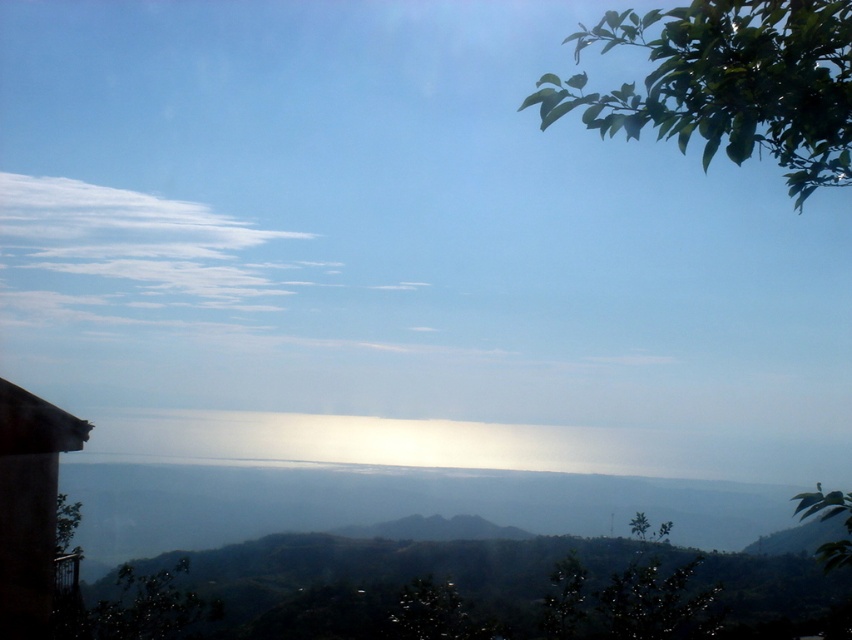
Question: Which is farther from the white fluffy cloud at upper left?

Choices:
 (A) green leafy branch at upper right
 (B) green leafy tree at upper right
 (C) green leafy tree at lower left

Answer: (B)

Question: Which point is closer to the camera?

Choices:
 (A) green leafy tree at lower left
 (B) brown wooden hut at lower left
 (C) green leafy tree at upper right

Answer: (C)

Question: Is white fluffy cloud at upper left smaller than green leafy tree at lower left?

Choices:
 (A) no
 (B) yes

Answer: (A)

Question: Does white fluffy cloud at upper left have a smaller size compared to green leafy tree at lower right?

Choices:
 (A) no
 (B) yes

Answer: (A)

Question: Which of these objects is positioned closest to the green leafy tree at lower right?

Choices:
 (A) white fluffy cloud at upper left
 (B) brown wooden hut at lower left
 (C) green leafy branch at upper right

Answer: (C)

Question: Does brown wooden hut at lower left have a lesser width compared to green leafy tree at upper right?

Choices:
 (A) no
 (B) yes

Answer: (A)